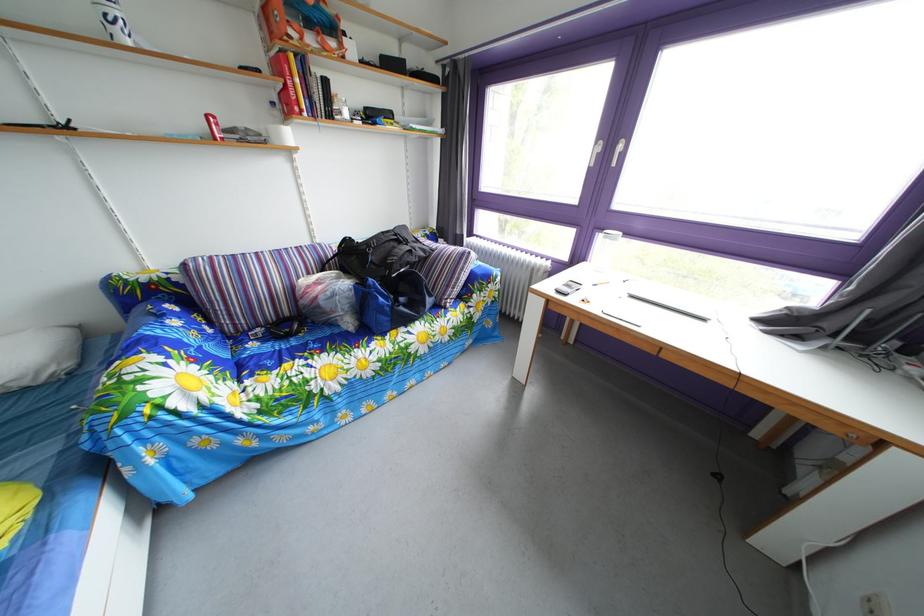
You are a GUI agent. You are given a task and a screenshot of the screen. Output one action in this format:
    pyautogui.click(x=<x>, y=<y>)
    Task: Click on the sofa sitting surface
    The image size is (924, 616).
    Given the screenshot: What is the action you would take?
    pyautogui.click(x=313, y=357)